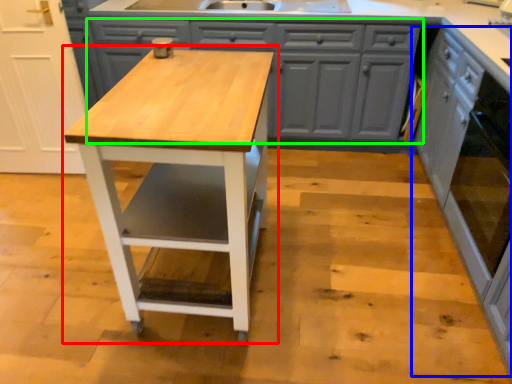
Question: Based on their relative distances, which object is farther from table (highlighted by a red box)? Choose from cabinetry (highlighted by a blue box) and cabinetry (highlighted by a green box).

Choices:
 (A) cabinetry
 (B) cabinetry

Answer: (A)